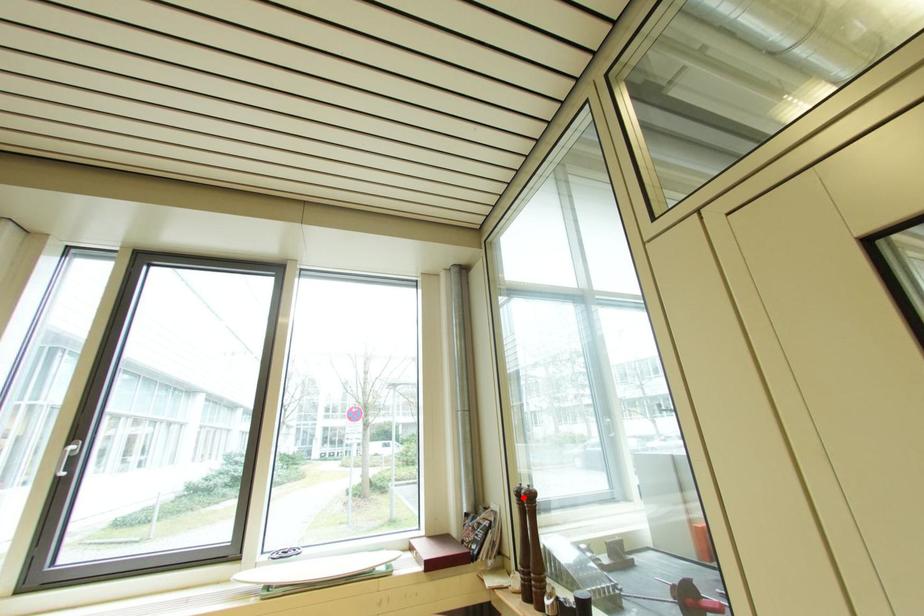
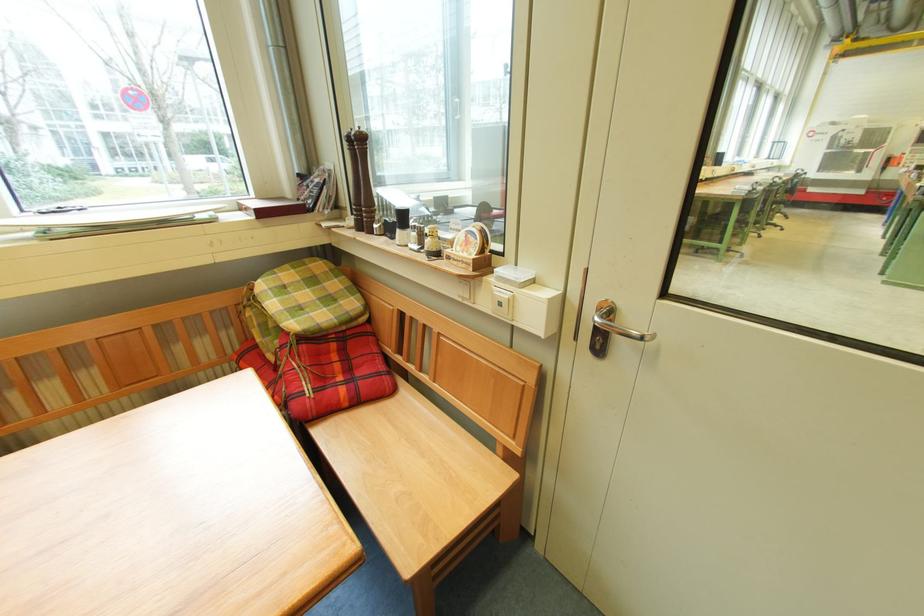
Question: I am providing you with two images of the same scene from different viewpoints. Given a red point in image1, look at the same physical point in image2. Is it:

Choices:
 (A) Closer to the viewpoint
 (B) Farther from the viewpoint

Answer: (A)